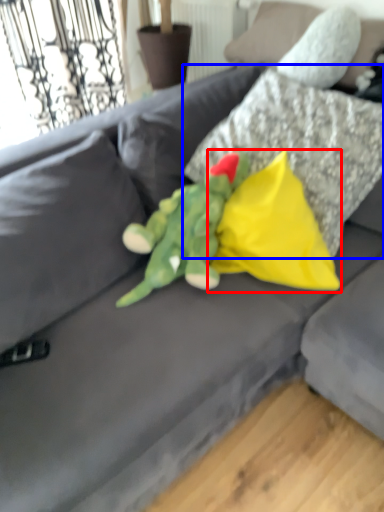
Question: Among these objects, which one is nearest to the camera, pillow (highlighted by a red box) or pillow (highlighted by a blue box)?

Choices:
 (A) pillow
 (B) pillow

Answer: (B)